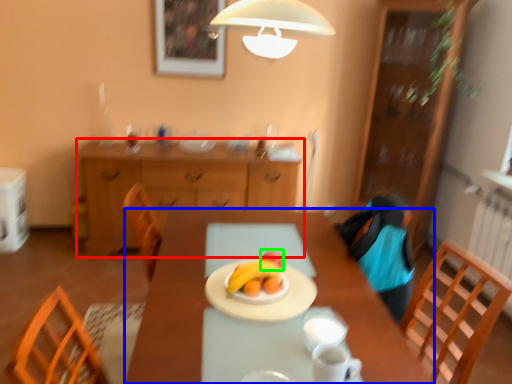
Question: Which object is the closest to the cabinetry (highlighted by a red box)? Choose among these: desk (highlighted by a blue box) or fruit (highlighted by a green box).

Choices:
 (A) desk
 (B) fruit

Answer: (A)